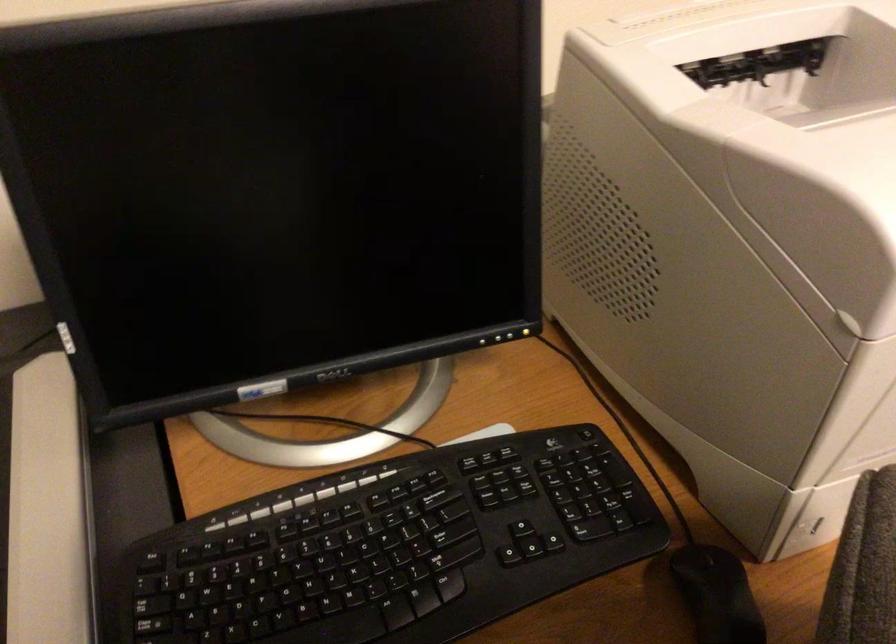
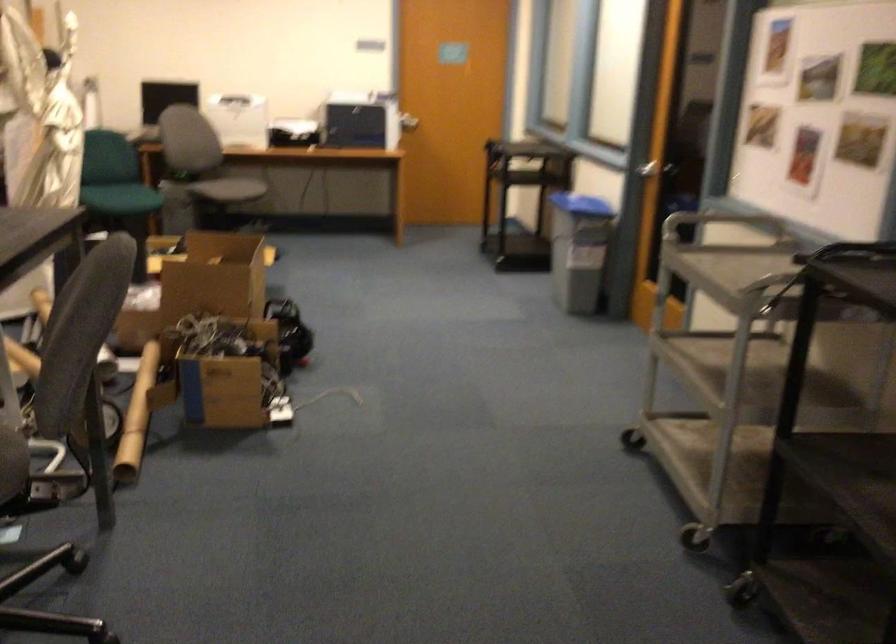
Question: I am providing you with two images of the same scene from different viewpoints. Which of the following objects are not visible in image2?

Choices:
 (A) grey chair sitting surface
 (B) cardboard tube
 (C) monitor control button
 (D) green bucket

Answer: (C)